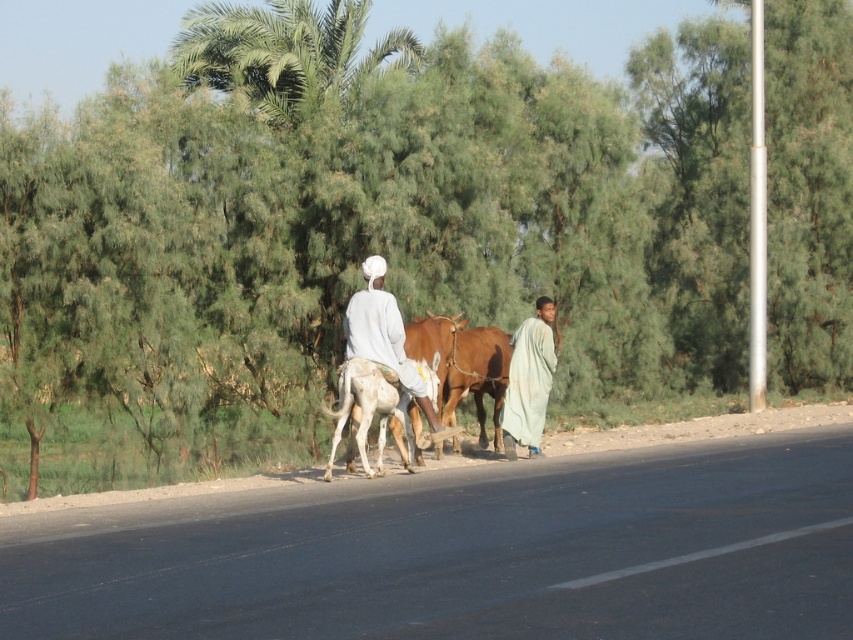
Question: Does green leafy palm tree at upper center have a smaller size compared to light green fabric at center?

Choices:
 (A) yes
 (B) no

Answer: (B)

Question: Which object appears farthest from the camera in this image?

Choices:
 (A) green leafy palm tree at upper center
 (B) white smooth donkey at center

Answer: (A)

Question: Is green leafy palm tree at upper center smaller than brown glossy bull at center?

Choices:
 (A) no
 (B) yes

Answer: (A)

Question: Is green leafy palm tree at upper center positioned before light green fabric at center?

Choices:
 (A) no
 (B) yes

Answer: (A)

Question: Among these objects, which one is farthest from the camera?

Choices:
 (A) brown glossy bull at center
 (B) white smooth donkey at center
 (C) green leafy palm tree at upper center

Answer: (C)

Question: Estimate the real-world distances between objects in this image. Which object is closer to the light green fabric at center?

Choices:
 (A) white smooth donkey at center
 (B) green leafy palm tree at upper center

Answer: (A)